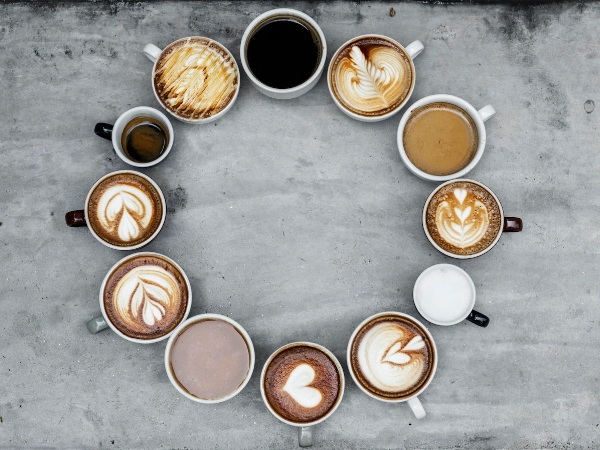
Identify the location of mug handle. The image size is (600, 450). (76, 220), (101, 131), (151, 46), (413, 45), (487, 114), (516, 222), (481, 319), (418, 404), (302, 436), (94, 320).